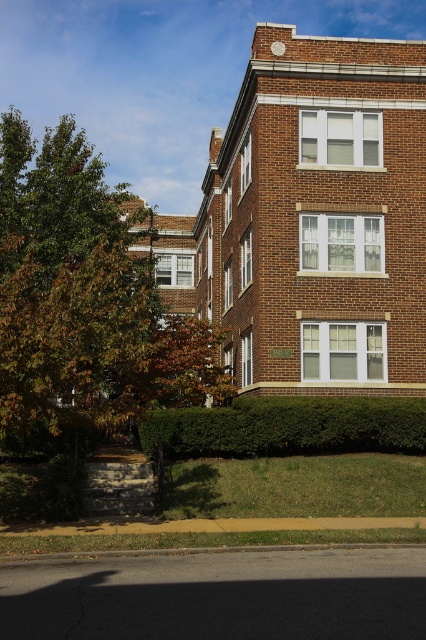
Who is more distant from viewer, (5, 320) or (389, 410)?

The point (389, 410) is behind.

Can you confirm if green leafy tree at upper left is positioned below green leafy hedge at lower center?

Result: Actually, green leafy tree at upper left is above green leafy hedge at lower center.

Does point (55, 138) lie behind point (204, 419)?

Yes, point (55, 138) is behind point (204, 419).

What are the coordinates of `green leafy tree at upper left` in the screenshot? It's located at coord(83,301).